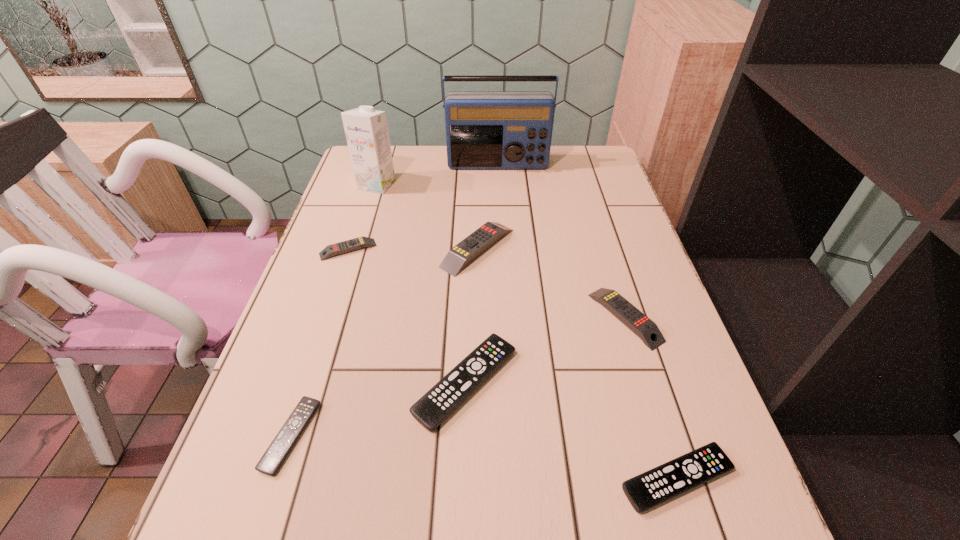
Find the location of a particular element. The image size is (960, 540). free space at the far right corner of the desktop is located at coordinates (603, 161).

You are a GUI agent. You are given a task and a screenshot of the screen. Output one action in this format:
    pyautogui.click(x=<x>, y=<y>)
    Task: Click on the empty space between the carton and the second smallest black remote control
    
    Given the screenshot: What is the action you would take?
    pyautogui.click(x=527, y=332)

The width and height of the screenshot is (960, 540). What are the coordinates of `vacant area that lies between the biggest black remote control and the leftmost yellow remote control` in the screenshot? It's located at (407, 316).

Where is `free space between the smallest yellow remote control and the shortest object`? free space between the smallest yellow remote control and the shortest object is located at coordinates (320, 343).

Where is `free point between the rightmost black remote control and the second yellow remote control from right to left`? Image resolution: width=960 pixels, height=540 pixels. free point between the rightmost black remote control and the second yellow remote control from right to left is located at coordinates (577, 363).

The image size is (960, 540). I want to click on blank region between the smallest black remote control and the second farthest object, so click(x=334, y=310).

Identify the location of vacant point located between the shortest object and the smallest yellow remote control. The image size is (960, 540). (320, 343).

In order to click on free space that is in between the biggest black remote control and the third tallest object in this screenshot , I will do `click(471, 315)`.

Where is `unoccupied area between the third tallest object and the blue radio receiver`? Image resolution: width=960 pixels, height=540 pixels. unoccupied area between the third tallest object and the blue radio receiver is located at coordinates (488, 207).

The image size is (960, 540). Find the location of `vacant space that is in between the second farthest object and the second black remote control from left to right`. vacant space that is in between the second farthest object and the second black remote control from left to right is located at coordinates (421, 284).